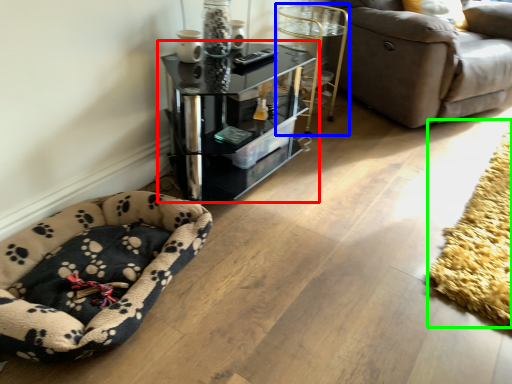
Question: Which object is positioned farthest from table (highlighted by a red box)? Select from side table (highlighted by a blue box) and mat (highlighted by a green box).

Choices:
 (A) side table
 (B) mat

Answer: (B)